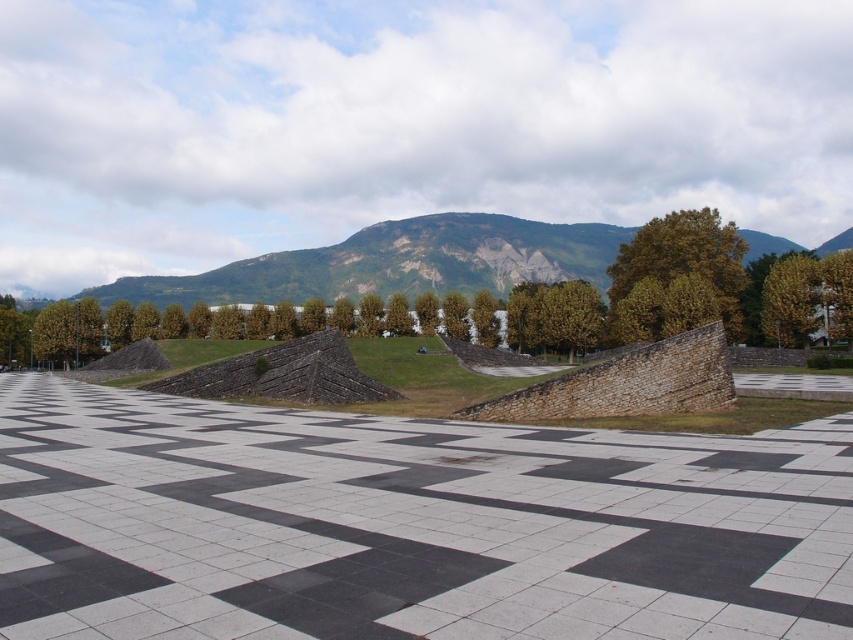
Consider the image. You are planning to place a picnic blanket in the image. The green grassy hill at center and the green leafy tree at right are both potential spots. Which location would allow the blanket to fit more comfortably without overlapping objects?

The green grassy hill at center has a larger size compared to the green leafy tree at right, so placing the picnic blanket there would provide more space and avoid overlapping with other objects.

You are standing at the edge of the black and white stone plaza at center and want to take a photo of the green leafy tree at upper right. Which direction should you face to ensure the tree is in the background of your photo?

You should face towards the green leafy tree at upper right because the black and white stone plaza at center is in front of it, so turning to look towards the tree will place it behind the plaza in your photo.

You are standing at the point labeled as point (407, 524) in the image. What is the name of the feature you are currently standing on?

You are standing on the black and white stone plaza at center as indicated by the point (407, 524).